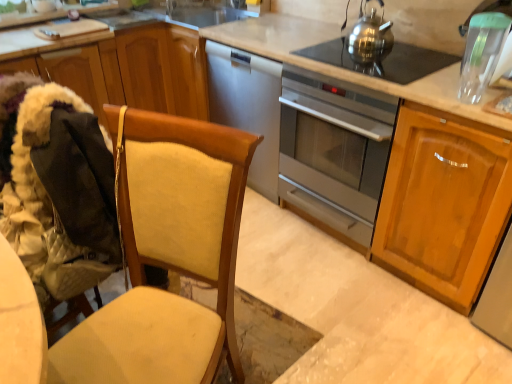
Locate an element on the screen. This screenshot has width=512, height=384. transparent plastic container at upper right is located at coordinates (482, 53).

The width and height of the screenshot is (512, 384). Describe the element at coordinates (120, 66) in the screenshot. I see `wooden cabinet at left, the second cabinetry viewed from the right` at that location.

Describe the element at coordinates (167, 255) in the screenshot. I see `beige fabric chair at left` at that location.

What do you see at coordinates (333, 151) in the screenshot? I see `satin silver oven at center` at bounding box center [333, 151].

How much space does light brown wood cabinet at right, placed as the 2th cabinetry when sorted from left to right, occupy vertically?

It is 86.86 centimeters.

The image size is (512, 384). Describe the element at coordinates (382, 60) in the screenshot. I see `polished stainless steel gas stove at upper center` at that location.

At what (x,y) coordinates should I click in order to perform the action: click on transparent plastic container at upper right. Please return your answer as a coordinate pair (x, y). The image size is (512, 384). Looking at the image, I should click on (482, 53).

Where is `tea pot above the satin silver oven at center (from a real-world perspective)`? The width and height of the screenshot is (512, 384). tea pot above the satin silver oven at center (from a real-world perspective) is located at coordinates (370, 38).

Does satin silver oven at center have a greater width compared to shiny metallic kettle at upper right?

Indeed, satin silver oven at center has a greater width compared to shiny metallic kettle at upper right.

Which object is positioned more to the left, satin silver oven at center or shiny metallic kettle at upper right?

Positioned to the left is satin silver oven at center.

Can you confirm if transparent plastic container at upper right is positioned to the right of wooden cabinet at left, the second cabinetry viewed from the right?

Indeed, transparent plastic container at upper right is positioned on the right side of wooden cabinet at left, the second cabinetry viewed from the right.

Is transparent plastic container at upper right not near wooden cabinet at left, acting as the first cabinetry starting from the left?

Yes, transparent plastic container at upper right and wooden cabinet at left, acting as the first cabinetry starting from the left, are quite far apart.

Which is in front, point (466, 71) or point (97, 105)?

Positioned in front is point (466, 71).

Considering the sizes of objects beige fabric folding chair at left and shiny metallic kettle at upper right in the image provided, who is bigger, beige fabric folding chair at left or shiny metallic kettle at upper right?

beige fabric folding chair at left.

Considering the sizes of objects beige fabric folding chair at left and shiny metallic kettle at upper right in the image provided, who is taller, beige fabric folding chair at left or shiny metallic kettle at upper right?

With more height is beige fabric folding chair at left.

Is beige fabric folding chair at left far away from shiny metallic kettle at upper right?

Yes, beige fabric folding chair at left and shiny metallic kettle at upper right are located far from each other.

Is beige fabric chair at left facing away from light brown wood cabinet at right, which is the 1th cabinetry in right-to-left order?

No, beige fabric chair at left is not facing away from light brown wood cabinet at right, which is the 1th cabinetry in right-to-left order.

Considering the positions of objects beige fabric chair at left and light brown wood cabinet at right, placed as the 2th cabinetry when sorted from left to right, in the image provided, who is more to the left, beige fabric chair at left or light brown wood cabinet at right, placed as the 2th cabinetry when sorted from left to right,?

beige fabric chair at left.

Are beige fabric chair at left and light brown wood cabinet at right, which is the 1th cabinetry in right-to-left order, located far from each other?

No, there isn't a large distance between beige fabric chair at left and light brown wood cabinet at right, which is the 1th cabinetry in right-to-left order.

From a real-world perspective, relative to wooden cabinet at left, acting as the first cabinetry starting from the left, is satin silver oven at center vertically above or below?

Clearly, from a real-world perspective, satin silver oven at center is below wooden cabinet at left, acting as the first cabinetry starting from the left.

Between satin silver oven at center and wooden cabinet at left, acting as the first cabinetry starting from the left, which one has less height?

wooden cabinet at left, acting as the first cabinetry starting from the left.

Considering the positions of objects satin silver oven at center and wooden cabinet at left, acting as the first cabinetry starting from the left, in the image provided, who is more to the right, satin silver oven at center or wooden cabinet at left, acting as the first cabinetry starting from the left,?

satin silver oven at center.

Is satin silver oven at center far away from wooden cabinet at left, acting as the first cabinetry starting from the left?

That's not correct — satin silver oven at center is a little close to wooden cabinet at left, acting as the first cabinetry starting from the left.

Is satin silver oven at center to the right of transparent plastic container at upper right from the viewer's perspective?

No, satin silver oven at center is not to the right of transparent plastic container at upper right.

Which object is thinner, satin silver oven at center or transparent plastic container at upper right?

With smaller width is transparent plastic container at upper right.

Which object is closer to the camera, satin silver oven at center or transparent plastic container at upper right?

transparent plastic container at upper right is more forward.

Between beige fabric chair at left and shiny metallic kettle at upper right, which one has larger size?

With larger size is beige fabric chair at left.

Which is nearer, (207, 127) or (384, 32)?

The point (207, 127) is more forward.

Considering the sizes of beige fabric chair at left and shiny metallic kettle at upper right in the image, is beige fabric chair at left taller or shorter than shiny metallic kettle at upper right?

Considering their sizes, beige fabric chair at left has more height than shiny metallic kettle at upper right.

This screenshot has height=384, width=512. I want to click on tea pot that appears behind the satin silver oven at center, so click(x=370, y=38).

Identify the location of cabinetry above the transparent plastic container at upper right (from the image's perspective). click(x=120, y=66).

Looking at the image, which one is located closer to beige fabric folding chair at left, wooden cabinet at left, acting as the first cabinetry starting from the left, or light brown wood cabinet at right, which is the 1th cabinetry in right-to-left order?

wooden cabinet at left, acting as the first cabinetry starting from the left.

Which object lies nearer to the anchor point satin silver oven at center, transparent plastic container at upper right or light brown wood cabinet at right, which is the 1th cabinetry in right-to-left order?

The object closer to satin silver oven at center is light brown wood cabinet at right, which is the 1th cabinetry in right-to-left order.

Estimate the real-world distances between objects in this image. Which object is further from wooden cabinet at left, the second cabinetry viewed from the right, satin silver oven at center or light brown wood cabinet at right, which is the 1th cabinetry in right-to-left order?

The object further to wooden cabinet at left, the second cabinetry viewed from the right, is light brown wood cabinet at right, which is the 1th cabinetry in right-to-left order.

Which object lies nearer to the anchor point wooden cabinet at left, the second cabinetry viewed from the right, light brown wood cabinet at right, which is the 1th cabinetry in right-to-left order, or shiny metallic kettle at upper right?

shiny metallic kettle at upper right is closer to wooden cabinet at left, the second cabinetry viewed from the right.

Estimate the real-world distances between objects in this image. Which object is closer to light brown wood cabinet at right, which is the 1th cabinetry in right-to-left order, beige fabric chair at left or beige fabric folding chair at left?

Among the two, beige fabric chair at left is located nearer to light brown wood cabinet at right, which is the 1th cabinetry in right-to-left order.

From the image, which object appears to be nearer to wooden cabinet at left, acting as the first cabinetry starting from the left, satin silver oven at center or beige fabric folding chair at left?

The object closer to wooden cabinet at left, acting as the first cabinetry starting from the left, is satin silver oven at center.

Based on their spatial positions, is beige fabric folding chair at left or beige fabric chair at left further from shiny metallic kettle at upper right?

The object further to shiny metallic kettle at upper right is beige fabric folding chair at left.

Considering their positions, is satin silver oven at center positioned closer to beige fabric folding chair at left than wooden cabinet at left, acting as the first cabinetry starting from the left?

Based on the image, wooden cabinet at left, acting as the first cabinetry starting from the left, appears to be nearer to beige fabric folding chair at left.

The image size is (512, 384). I want to click on chair between beige fabric folding chair at left and shiny metallic kettle at upper right from left to right, so click(x=167, y=255).

Where is `kitchen appliance between wooden cabinet at left, the second cabinetry viewed from the right, and light brown wood cabinet at right, placed as the 2th cabinetry when sorted from left to right, in the horizontal direction`? The height and width of the screenshot is (384, 512). kitchen appliance between wooden cabinet at left, the second cabinetry viewed from the right, and light brown wood cabinet at right, placed as the 2th cabinetry when sorted from left to right, in the horizontal direction is located at coordinates (333, 151).

Where is `tea pot between wooden cabinet at left, the second cabinetry viewed from the right, and polished stainless steel gas stove at upper center from left to right`? This screenshot has width=512, height=384. tea pot between wooden cabinet at left, the second cabinetry viewed from the right, and polished stainless steel gas stove at upper center from left to right is located at coordinates (370, 38).

Locate an element on the screen. The height and width of the screenshot is (384, 512). kitchen appliance between beige fabric folding chair at left and shiny metallic kettle at upper right from left to right is located at coordinates (333, 151).